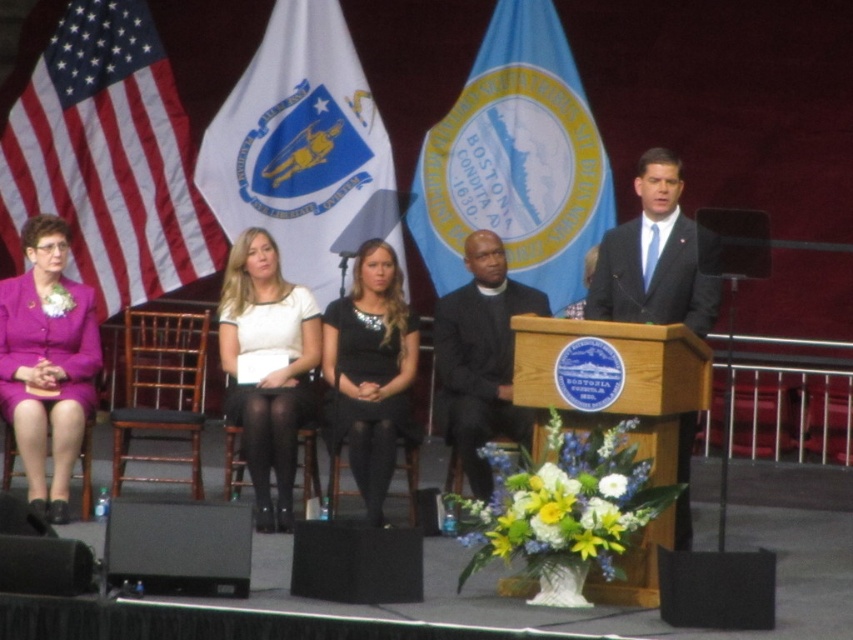
Which is more to the left, red-white striped flag at left or black leather chair at lower left?

From the viewer's perspective, red-white striped flag at left appears more on the left side.

Which of these two, red-white striped flag at left or black leather chair at lower left, stands taller?

With more height is red-white striped flag at left.

What do you see at coordinates (108, 157) in the screenshot? I see `red-white striped flag at left` at bounding box center [108, 157].

Locate an element on the screen. This screenshot has width=853, height=640. red-white striped flag at left is located at coordinates (108, 157).

Who is shorter, red-white striped flag at left or black matte speaker at lower center?

Standing shorter between the two is black matte speaker at lower center.

Does red-white striped flag at left appear under black matte speaker at lower center?

Actually, red-white striped flag at left is above black matte speaker at lower center.

Does point (83, 113) come behind point (309, 593)?

Yes.

The height and width of the screenshot is (640, 853). I want to click on red-white striped flag at left, so click(x=108, y=157).

Is blue fabric flag at center wider than purple satin suit at left?

Yes, blue fabric flag at center is wider than purple satin suit at left.

Is blue fabric flag at center to the right of purple satin suit at left from the viewer's perspective?

Correct, you'll find blue fabric flag at center to the right of purple satin suit at left.

Is point (579, 259) closer to camera compared to point (49, 387)?

No, (579, 259) is further to viewer.

Locate an element on the screen. The width and height of the screenshot is (853, 640). blue fabric flag at center is located at coordinates (515, 161).